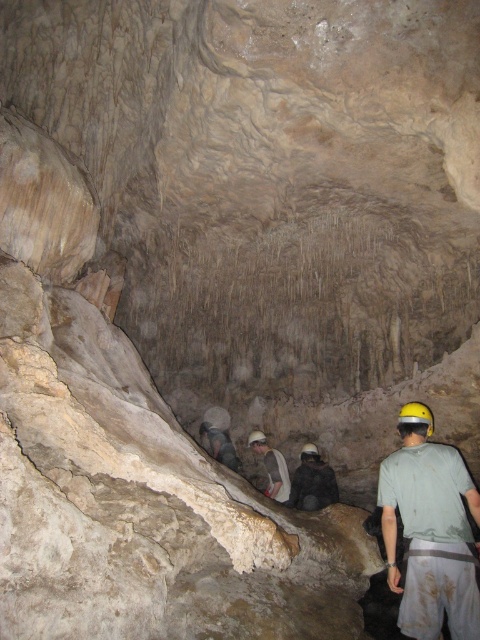
Question: Can you confirm if yellow hard hat at center is thinner than dark gray fabric construction worker at center?

Choices:
 (A) no
 (B) yes

Answer: (B)

Question: Which is farther from the white hard hat at center?

Choices:
 (A) dark gray fabric construction worker at center
 (B) yellow hard hat at center

Answer: (B)

Question: Is dark gray fabric construction worker at center smaller than white hard hat at center?

Choices:
 (A) no
 (B) yes

Answer: (B)

Question: Which is nearer to the yellow hard hat at center?

Choices:
 (A) white hard hat at center
 (B) dark gray fabric construction worker at center

Answer: (B)

Question: Which is farther from the yellow hard hat at center?

Choices:
 (A) white hard hat at center
 (B) dark gray fabric construction worker at center

Answer: (A)

Question: Is dark gray fabric construction worker at center bigger than white hard hat at center?

Choices:
 (A) yes
 (B) no

Answer: (B)